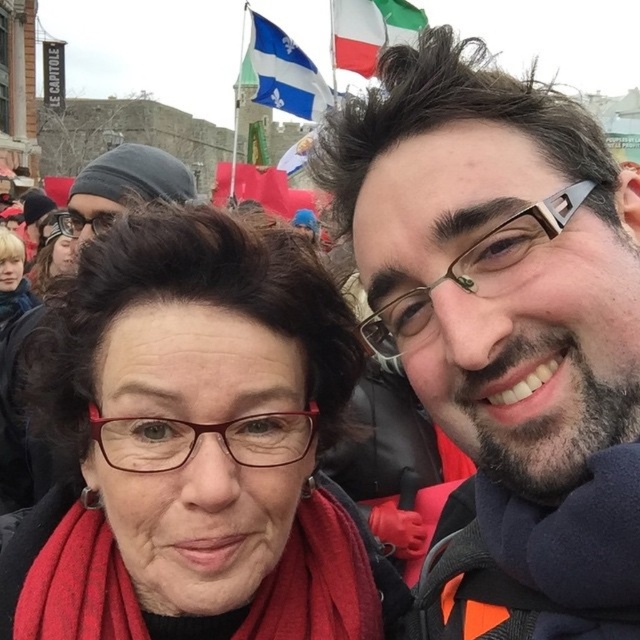
Question: Does matte black glasses at upper right appear on the right side of red woolen scarf at lower left?

Choices:
 (A) yes
 (B) no

Answer: (A)

Question: Does matte red scarf at center appear on the right side of blue and white striped flag at upper center?

Choices:
 (A) no
 (B) yes

Answer: (B)

Question: Can you confirm if matte black glasses at upper right is positioned to the left of blue and white striped flag at upper center?

Choices:
 (A) yes
 (B) no

Answer: (B)

Question: Considering the real-world distances, which object is farthest from the red woolen scarf at lower left?

Choices:
 (A) matte black glasses at upper right
 (B) matte red scarf at center
 (C) blue and white striped flag at upper center
 (D) white fabric flag at upper center

Answer: (C)

Question: Which of these objects is positioned farthest from the blue and white striped flag at upper center?

Choices:
 (A) white fabric flag at upper center
 (B) matte black glasses at upper right
 (C) matte red scarf at center

Answer: (C)

Question: Which of these objects is positioned closest to the blue and white striped flag at upper center?

Choices:
 (A) matte red scarf at center
 (B) red woolen scarf at lower left
 (C) matte black glasses at upper right

Answer: (C)